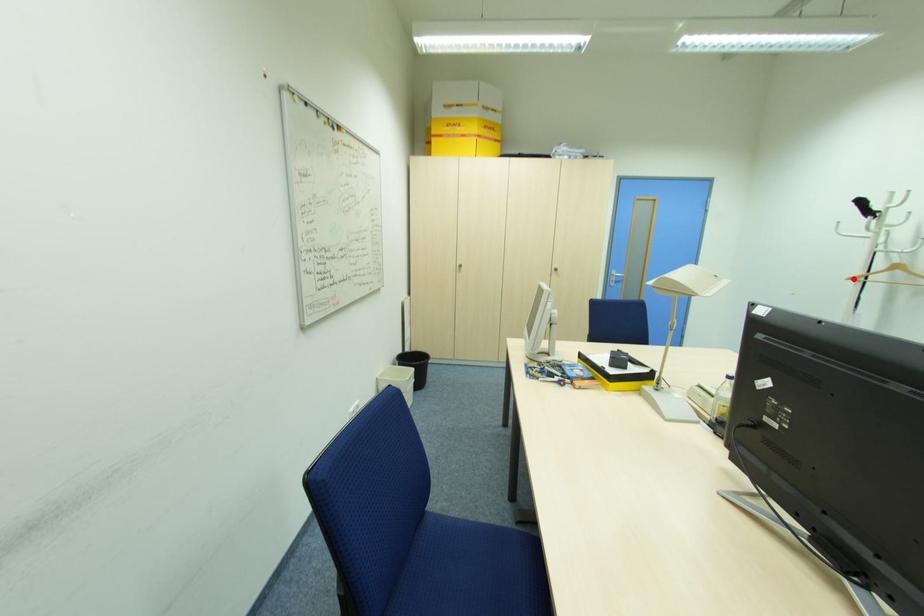
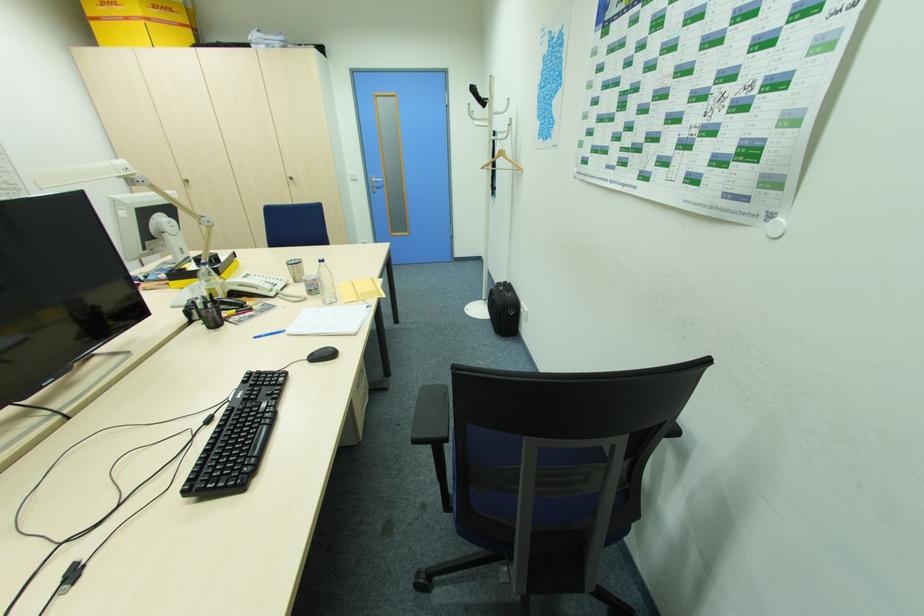
Question: I am providing you with two images of the same scene from different viewpoints. Given a red point in image1, look at the same physical point in image2. Is it:

Choices:
 (A) Closer to the viewpoint
 (B) Farther from the viewpoint

Answer: (A)